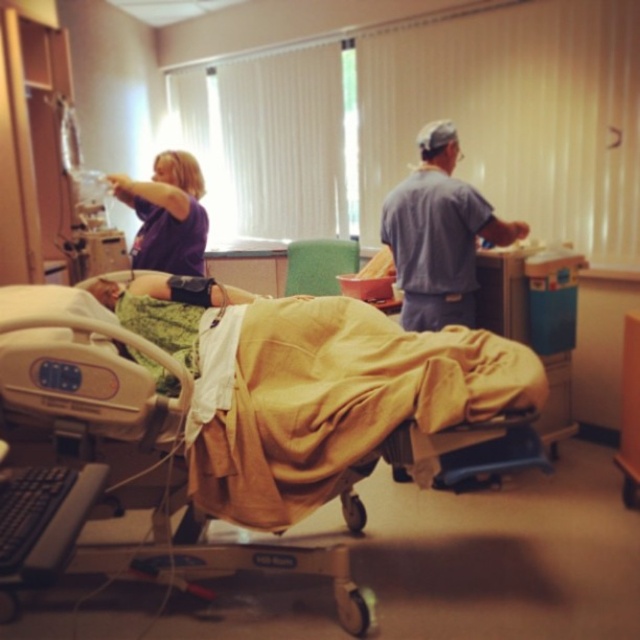
Question: From the image, what is the correct spatial relationship of blue scrubs at center in relation to purple matte shirt at upper left?

Choices:
 (A) below
 (B) above

Answer: (A)

Question: Among these points, which one is nearest to the camera?

Choices:
 (A) (406, 252)
 (B) (29, 333)
 (C) (166, 161)

Answer: (B)

Question: Where is yellow fabric bed at center located in relation to blue scrubs at center in the image?

Choices:
 (A) left
 (B) right

Answer: (A)

Question: Which of the following is the closest to the observer?

Choices:
 (A) (445, 164)
 (B) (284, 445)
 (C) (166, 248)

Answer: (B)

Question: Does yellow fabric bed at center appear on the left side of purple matte shirt at upper left?

Choices:
 (A) yes
 (B) no

Answer: (B)

Question: Estimate the real-world distances between objects in this image. Which object is farther from the yellow fabric bed at center?

Choices:
 (A) purple matte shirt at upper left
 (B) blue scrubs at center

Answer: (B)